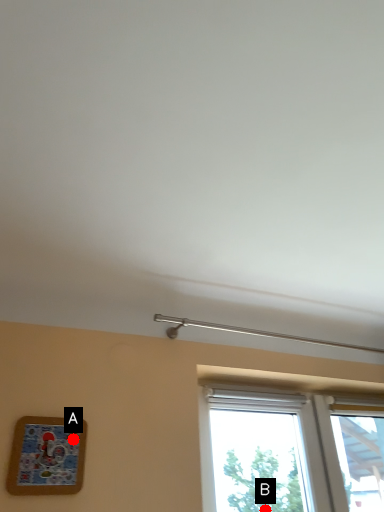
Question: Two points are circled on the image, labeled by A and B beside each circle. Which of the following is the farthest from the observer?

Choices:
 (A) A is further
 (B) B is further

Answer: (B)